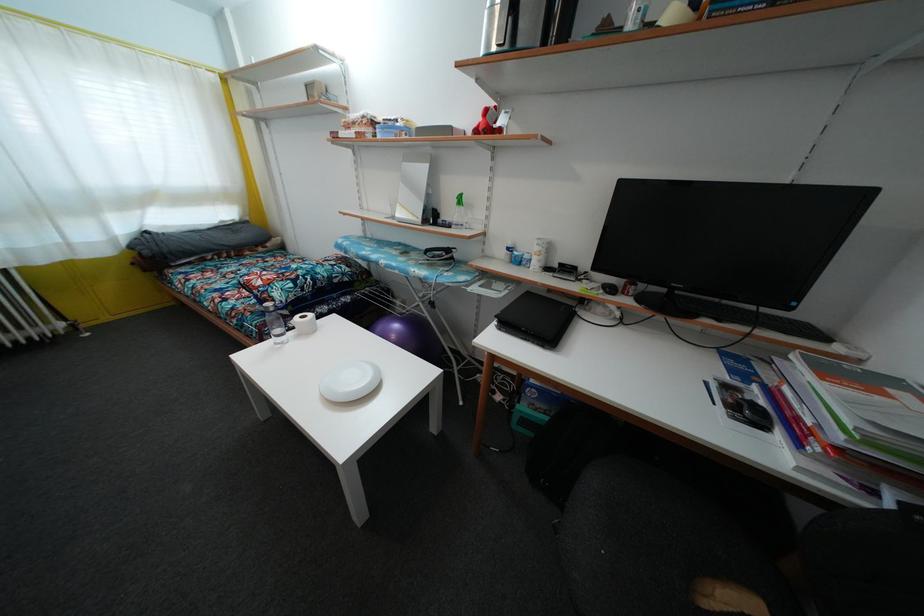
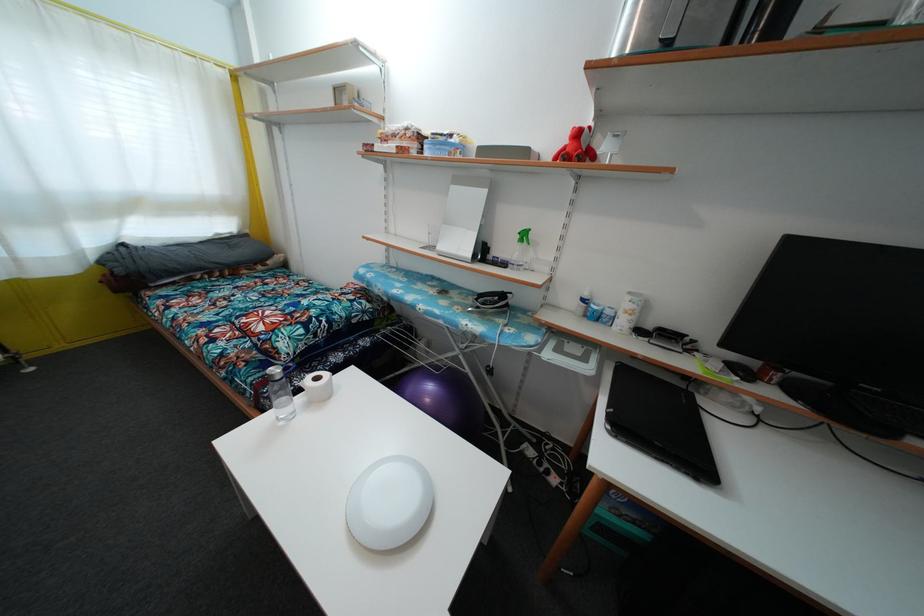
In the second image, find the point that corresponds to the point at 307,323 in the first image.

(321, 386)